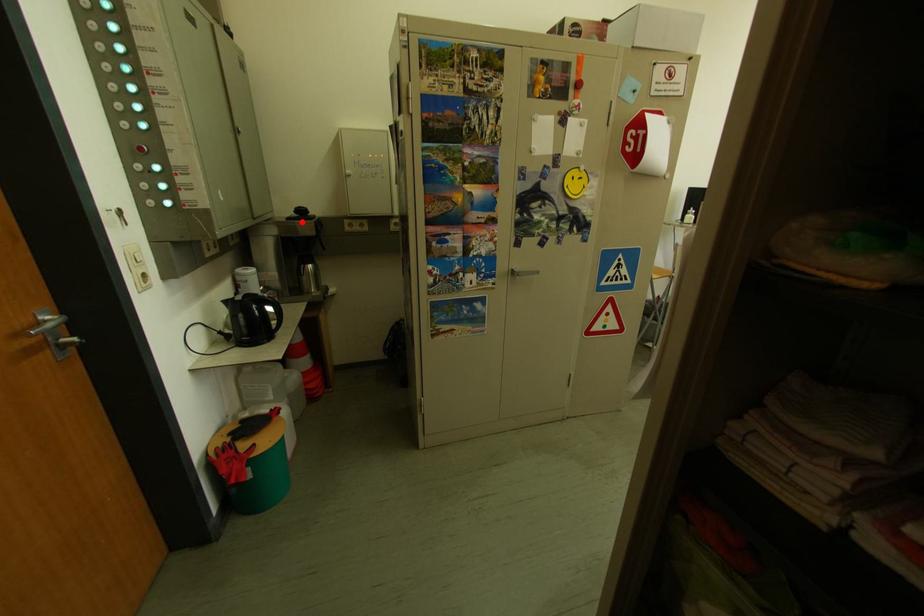
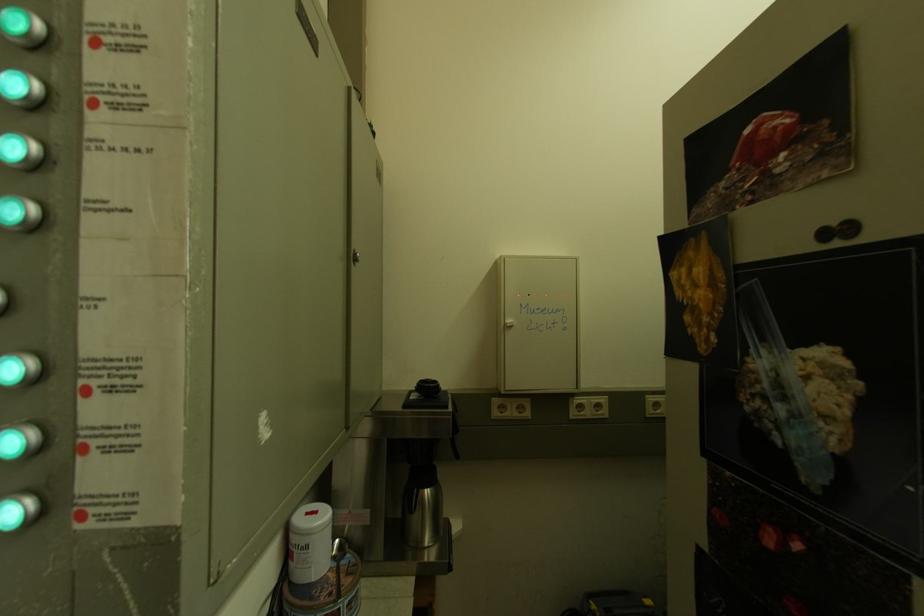
The point at the highlighted location is marked in the first image. Where is the corresponding point in the second image?

(420, 408)